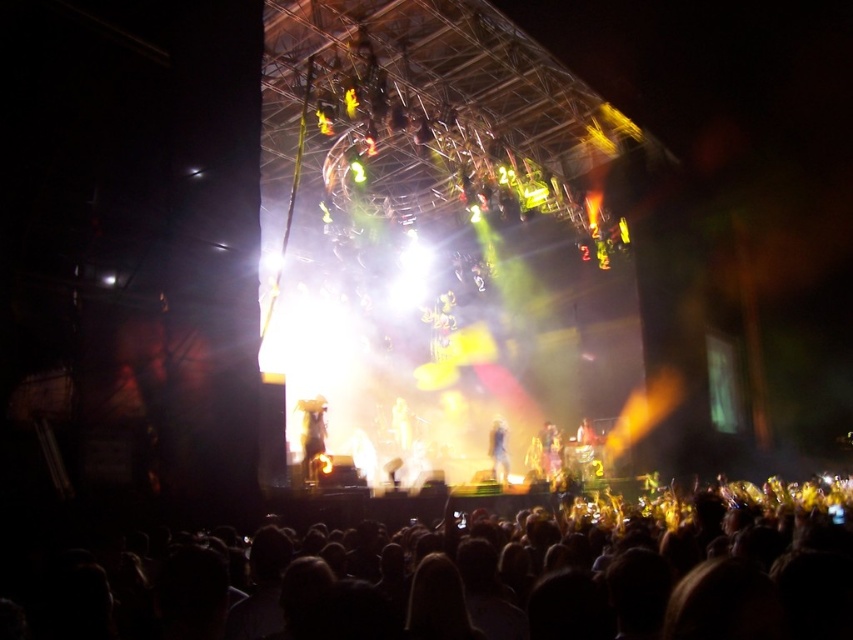
You are a photographer at the concert and want to capture a photo that includes both the smooth skin figure at center and the smooth white statue at center. Which one will appear taller in your photo?

The smooth skin figure at center will appear taller in the photo because it has a greater height compared to the smooth white statue at center.

You are a photographer at the concert and want to capture both the smooth skin figure at center and the smooth white statue at center in a single frame. Which one will appear bigger in the photo?

The smooth skin figure at center will appear bigger in the photo because it is larger in size than the smooth white statue at center.

Consider the image. You are a photographer standing at the edge of the concert venue. You want to take a photo that includes both the dark hair at lower center and the smooth white statue at center. Given that your camera has a maximum zoom range of 50 meters, will you be able to capture both subjects in a single frame without moving your position?

The distance between the dark hair at lower center and the smooth white statue at center is 38.11 meters, which is within the camera maximum zoom range of 50 meters. Therefore, you can capture both subjects in a single frame without moving your position.